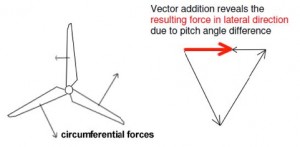
This screenshot has width=300, height=147. In order to click on three blade fan in this screenshot , I will do `click(75, 71)`.